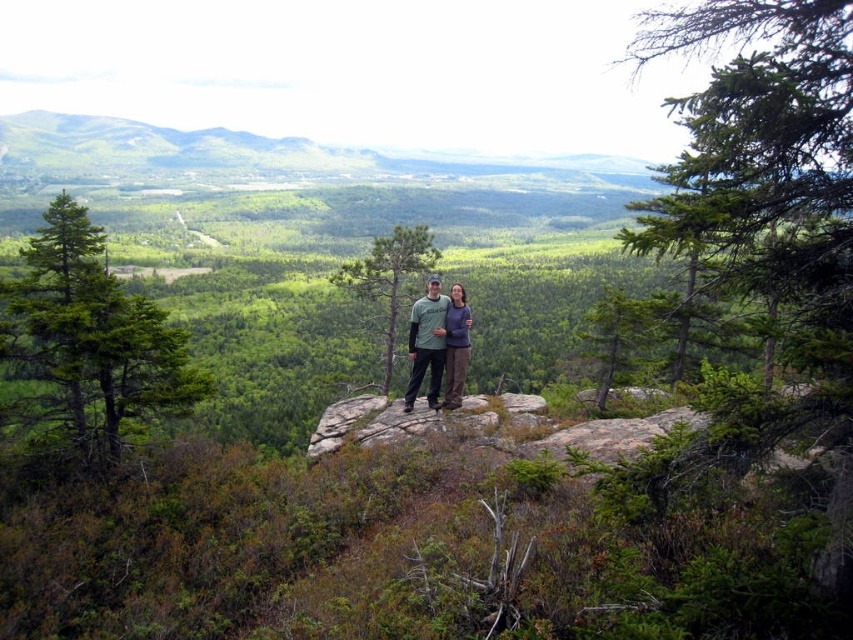
Question: Is green matte tree at left thinner than gray fabric jacket at center?

Choices:
 (A) yes
 (B) no

Answer: (B)

Question: Can you confirm if green matte tree at center is positioned above matte green t-shirt at center?

Choices:
 (A) no
 (B) yes

Answer: (B)

Question: Among these objects, which one is nearest to the camera?

Choices:
 (A) green needle-like foliage at upper right
 (B) matte green t-shirt at center

Answer: (A)

Question: Does green matte tree at center appear under matte green t-shirt at center?

Choices:
 (A) yes
 (B) no

Answer: (B)

Question: Which is farther from the green matte tree at center?

Choices:
 (A) gray fabric jacket at center
 (B) matte green t-shirt at center

Answer: (A)

Question: Which object is the closest to the gray fabric jacket at center?

Choices:
 (A) matte green t-shirt at center
 (B) green matte tree at left
 (C) green matte tree at center
 (D) green needle-like foliage at upper right

Answer: (A)